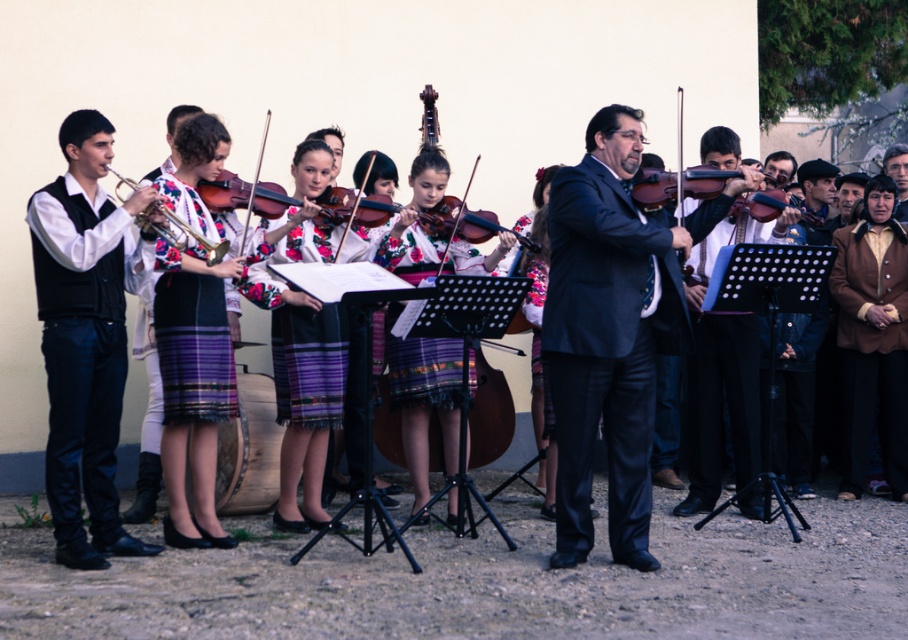
From the picture: You are standing at the center of the performance area and want to move towards the front of the stage. Which point, point [96,241] or point [388,412], should you head towards?

You should head towards point [96,241] because it is in front of point [388,412], meaning it is closer to the front of the stage.

You are a photographer at the event and want to ensure both the matte black suit at center and the wooden violin at center are clearly visible in your photo. Given their sizes, which object should you focus on first to ensure proper framing?

The matte black suit at center has a smaller size compared to wooden violin at center, so you should focus on the wooden violin at center first to ensure it is properly framed before adjusting for the smaller matte black suit at center.

You are a photographer standing at the edge of the performance area. You want to take a photo that includes both the black denim pants at left and the wooden polished cello at center. The camera you are using has a maximum focus range of 2.5 meters. Can you capture both subjects in focus without moving your position?

The black denim pants at left is 2.75 meters away from the wooden polished cello at center. Since the distance between them exceeds the camera maximum focus range of 2.5 meters, you cannot capture both subjects in focus without moving your position.